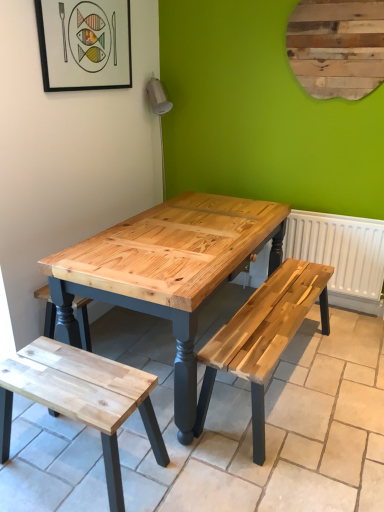
Question: In the image, is wooden plaque at upper right positioned in front of or behind white matte radiator at right?

Choices:
 (A) behind
 (B) front

Answer: (B)

Question: From a real-world perspective, relative to white matte radiator at right, is wooden plaque at upper right vertically above or below?

Choices:
 (A) below
 (B) above

Answer: (B)

Question: Which object is the closest to the matte black picture frame at upper left?

Choices:
 (A) natural wood bench at lower left
 (B) wooden plaque at upper right
 (C) white matte radiator at right

Answer: (B)

Question: Which is nearer to the matte black picture frame at upper left?

Choices:
 (A) wooden plaque at upper right
 (B) natural wood bench at lower left
 (C) white matte radiator at right

Answer: (A)